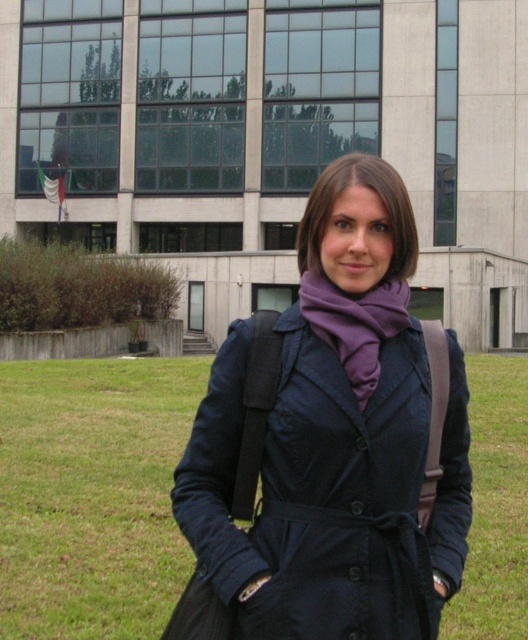
Which is more to the left, purple soft scarf at center or purple matte scarf at center?

Positioned to the left is purple soft scarf at center.

Who is shorter, purple soft scarf at center or purple matte scarf at center?

Standing shorter between the two is purple soft scarf at center.

Where is `purple soft scarf at center`? The width and height of the screenshot is (528, 640). purple soft scarf at center is located at coordinates (354, 324).

You are a GUI agent. You are given a task and a screenshot of the screen. Output one action in this format:
    pyautogui.click(x=<x>, y=<y>)
    Task: Click on the purple soft scarf at center
    
    Given the screenshot: What is the action you would take?
    pyautogui.click(x=354, y=324)

Can you confirm if matte black coat at center is shorter than purple soft scarf at center?

No.

Does point (268, 625) come farther from viewer compared to point (354, 349)?

No, (268, 625) is in front of (354, 349).

The image size is (528, 640). Find the location of `matte black coat at center`. matte black coat at center is located at coordinates (331, 442).

Between matte black coat at center and green grass at lower center, which one appears on the left side from the viewer's perspective?

From the viewer's perspective, green grass at lower center appears more on the left side.

Is matte black coat at center shorter than green grass at lower center?

Yes, matte black coat at center is shorter than green grass at lower center.

Measure the distance between matte black coat at center and camera.

matte black coat at center and camera are 1.84 meters apart.

Locate an element on the screen. The image size is (528, 640). matte black coat at center is located at coordinates (x=331, y=442).